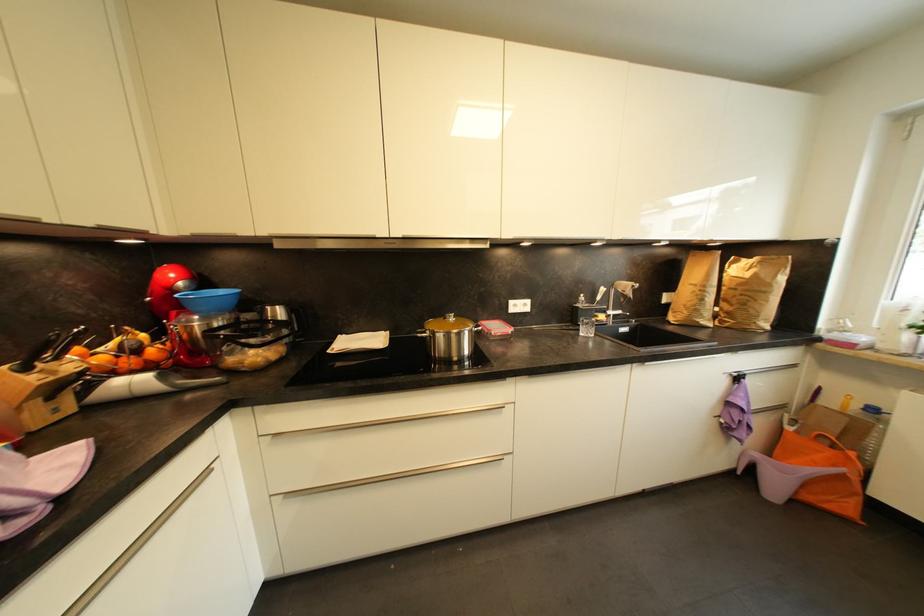
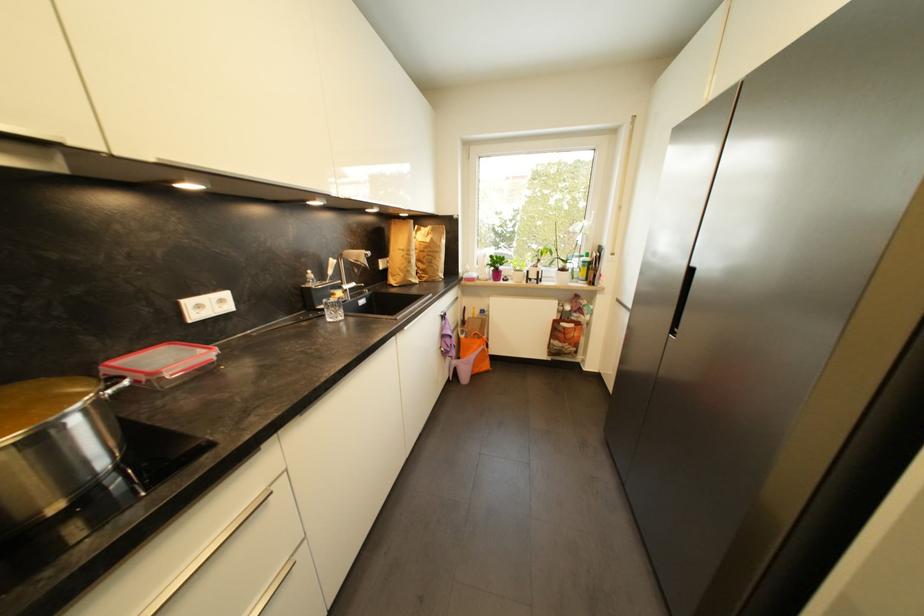
In the second image, find the point that corresponds to pixel 786 408 in the first image.

(463, 328)